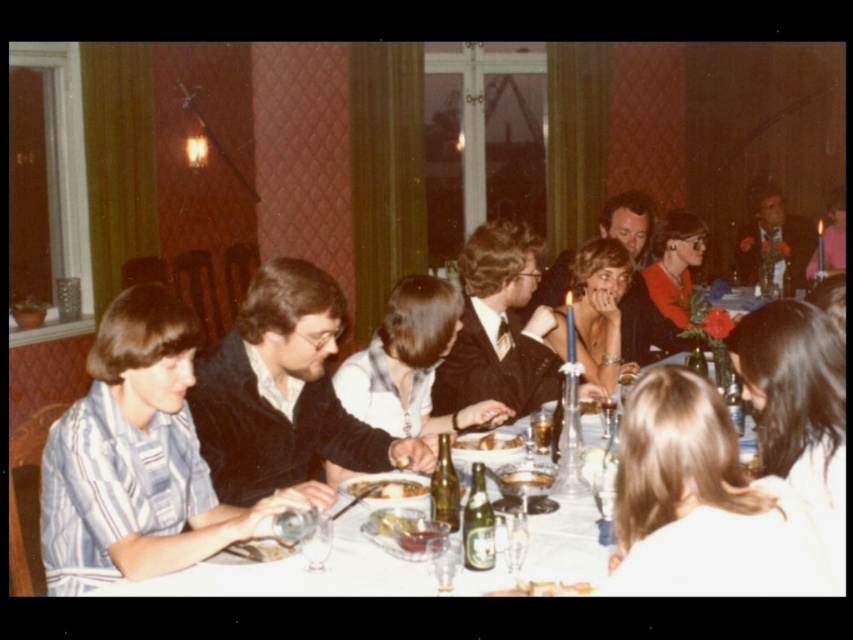
Consider the image. You are standing at the dining table and want to reach both the point at coordinates point (x=592, y=246) and point (x=469, y=433). Which point is closer to you?

Point (x=469, y=433) is closer to you because it is less further to the camera than point (x=592, y=246).